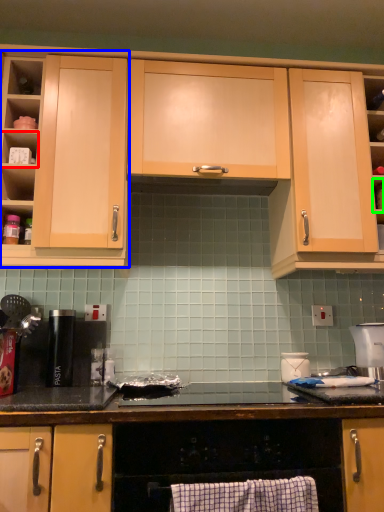
Question: Which object is positioned closest to shelf (highlighted by a red box)? Select from cabinetry (highlighted by a blue box) and shelf (highlighted by a green box).

Choices:
 (A) cabinetry
 (B) shelf

Answer: (A)